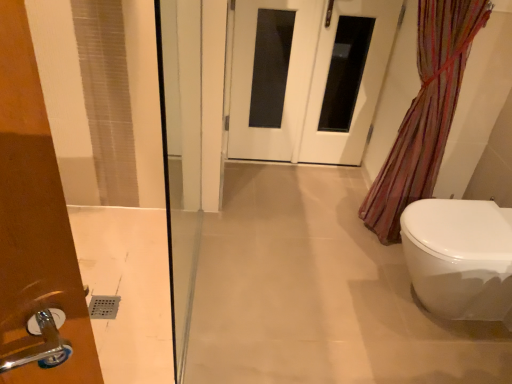
The height and width of the screenshot is (384, 512). In order to click on blank area to the left of translucent striped fabric at right in this screenshot , I will do `click(306, 227)`.